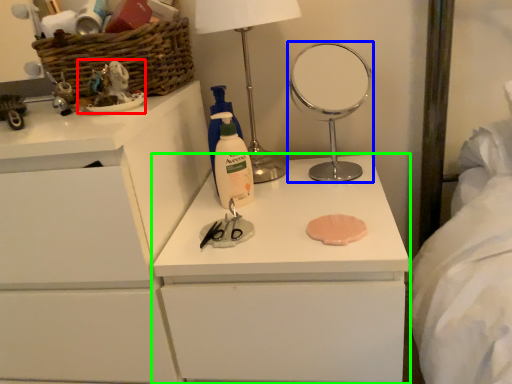
Question: Considering the real-world distances, which object is farthest from toy (highlighted by a red box)? mirror (highlighted by a blue box) or chest of drawers (highlighted by a green box)?

Choices:
 (A) mirror
 (B) chest of drawers

Answer: (A)